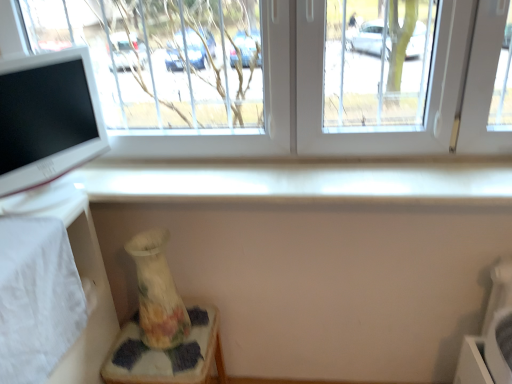
The height and width of the screenshot is (384, 512). I want to click on vacant point above white fabric table at lower left (from a real-world perspective), so click(29, 225).